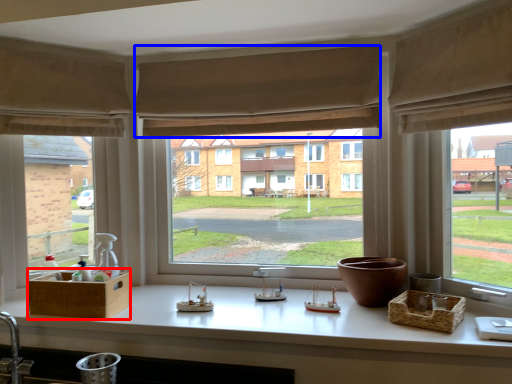
Question: Among these objects, which one is farthest to the camera, basket (highlighted by a red box) or curtain (highlighted by a blue box)?

Choices:
 (A) basket
 (B) curtain

Answer: (B)